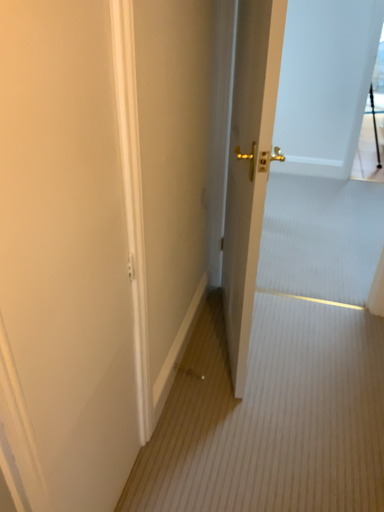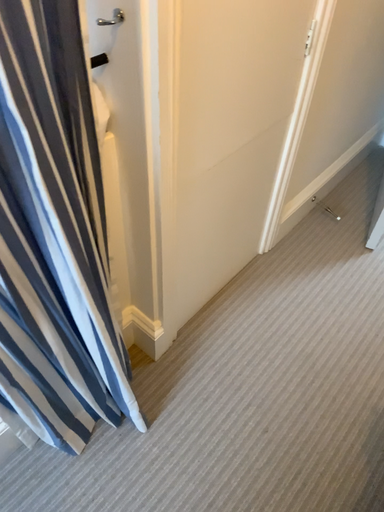
Question: Which way did the camera rotate in the video?

Choices:
 (A) rotated downward
 (B) rotated upward

Answer: (A)